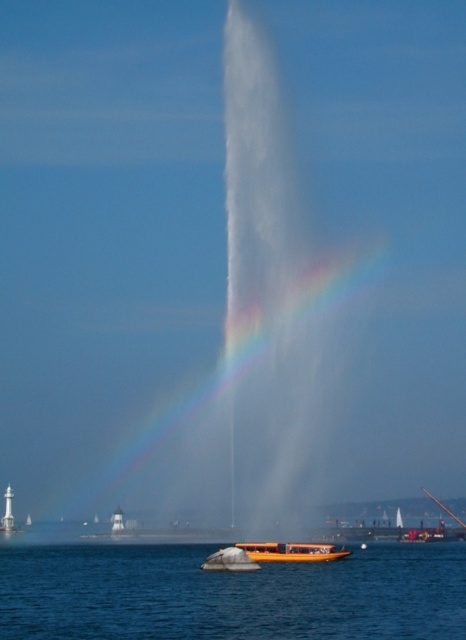
Question: Does rainbow translucent at center appear on the right side of blue water at lower center?

Choices:
 (A) no
 (B) yes

Answer: (A)

Question: Based on their relative distances, which object is nearer to the orange polished wood boat at center?

Choices:
 (A) rainbow translucent at center
 (B) blue water at lower center

Answer: (B)

Question: Where is rainbow translucent at center located in relation to blue water at lower center in the image?

Choices:
 (A) right
 (B) left

Answer: (B)

Question: Which object is positioned farthest from the blue water at lower center?

Choices:
 (A) rainbow translucent at center
 (B) orange polished wood boat at center

Answer: (A)

Question: Can you confirm if blue water at lower center is smaller than orange polished wood boat at center?

Choices:
 (A) no
 (B) yes

Answer: (A)

Question: Which point is closer to the camera taking this photo?

Choices:
 (A) (271, 460)
 (B) (306, 561)
 (C) (6, 579)

Answer: (C)